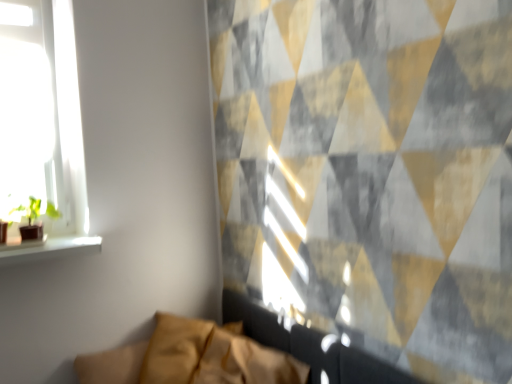
Question: Does green matte houseplant at left come in front of leather-like tan couch at lower center?

Choices:
 (A) no
 (B) yes

Answer: (A)

Question: Is green matte houseplant at left oriented towards leather-like tan couch at lower center?

Choices:
 (A) yes
 (B) no

Answer: (B)

Question: From the image's perspective, is green matte houseplant at left on leather-like tan couch at lower center?

Choices:
 (A) yes
 (B) no

Answer: (A)

Question: Is leather-like tan couch at lower center completely or partially inside green matte houseplant at left?

Choices:
 (A) yes
 (B) no

Answer: (B)

Question: Is the surface of green matte houseplant at left in direct contact with leather-like tan couch at lower center?

Choices:
 (A) yes
 (B) no

Answer: (B)

Question: From the image's perspective, is green matte houseplant at left below leather-like tan couch at lower center?

Choices:
 (A) no
 (B) yes

Answer: (A)

Question: Are leather-like tan couch at lower center and green matte houseplant at left far apart?

Choices:
 (A) yes
 (B) no

Answer: (B)

Question: Is green matte houseplant at left a part of leather-like tan couch at lower center?

Choices:
 (A) no
 (B) yes

Answer: (A)

Question: Does leather-like tan couch at lower center appear on the left side of green matte houseplant at left?

Choices:
 (A) yes
 (B) no

Answer: (B)

Question: Is leather-like tan couch at lower center turned away from green matte houseplant at left?

Choices:
 (A) yes
 (B) no

Answer: (B)

Question: Is leather-like tan couch at lower center not inside green matte houseplant at left?

Choices:
 (A) yes
 (B) no

Answer: (A)

Question: From a real-world perspective, does leather-like tan couch at lower center stand above green matte houseplant at left?

Choices:
 (A) no
 (B) yes

Answer: (A)

Question: Relative to green matte houseplant at left, is leather-like tan couch at lower center in front or behind?

Choices:
 (A) behind
 (B) front

Answer: (B)